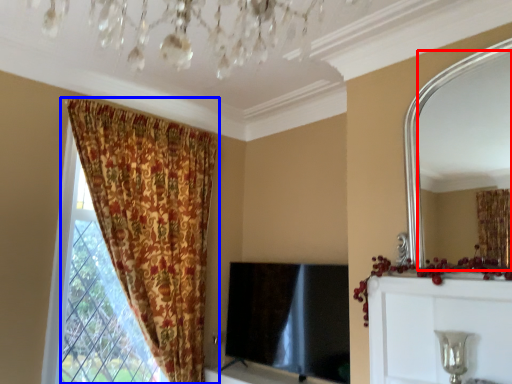
Question: Among these objects, which one is farthest to the camera, mirror (highlighted by a red box) or curtain (highlighted by a blue box)?

Choices:
 (A) mirror
 (B) curtain

Answer: (B)